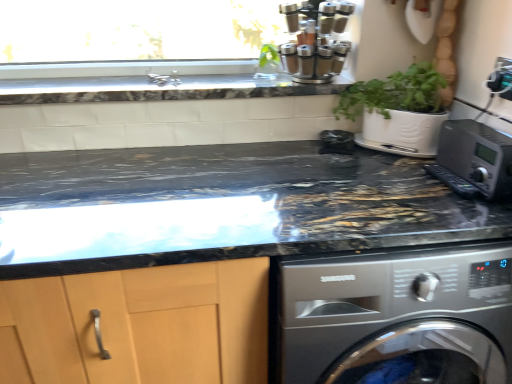
Find the location of `vacant area on top of metallic silver microwave at right (from a real-world perspective)`. vacant area on top of metallic silver microwave at right (from a real-world perspective) is located at coordinates (481, 132).